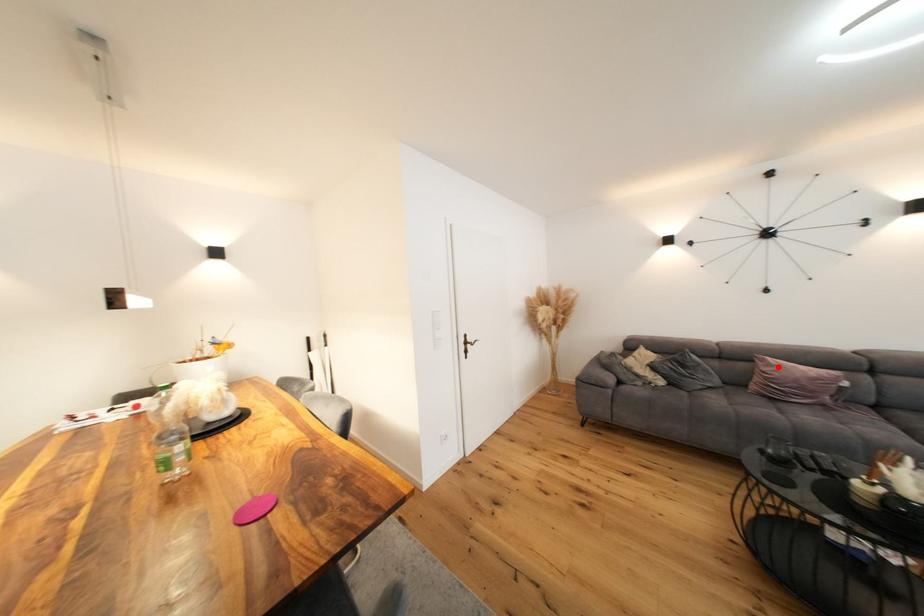
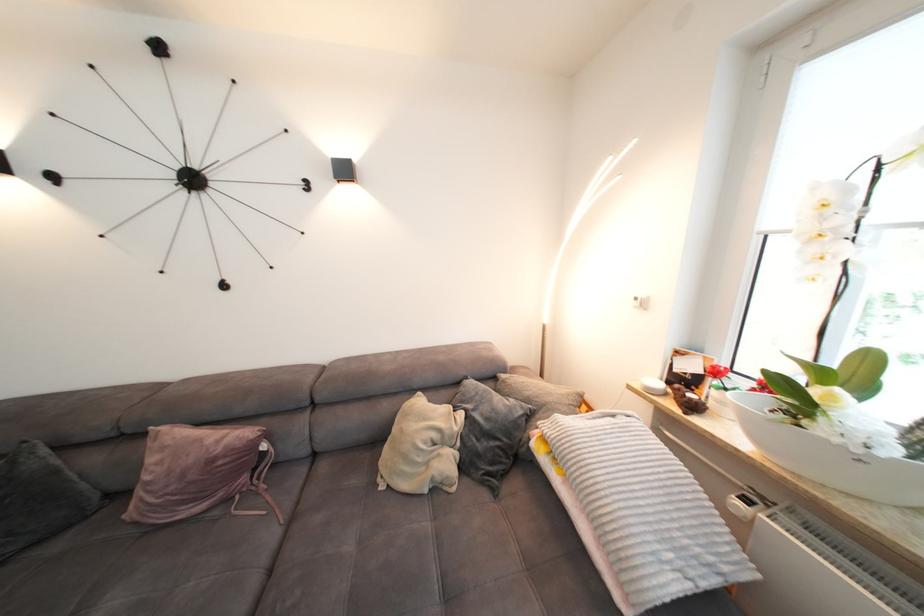
In the second image, find the point that corresponds to the highlighted location in the first image.

(171, 448)